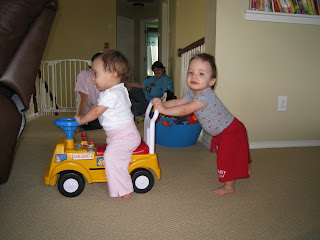
The height and width of the screenshot is (240, 320). In order to click on bottom of bookshelf in this screenshot , I will do `click(277, 17)`.